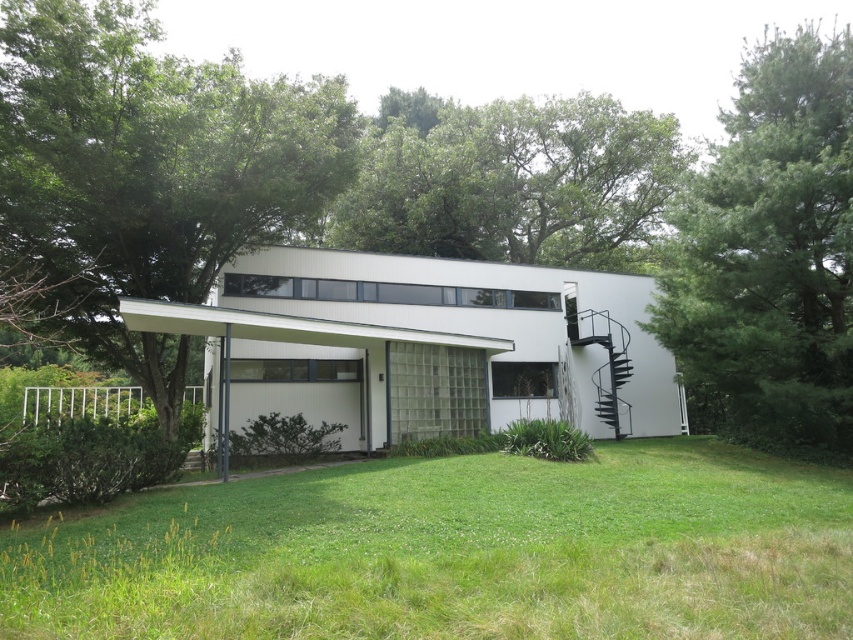
You are a landscape architect planning to add a new tree to the property. The client wants the new tree to be smaller than the existing green leafy tree at right but larger than the green leafy tree at center. Is this possible? Please explain using the trees mentioned.

The green leafy tree at right is larger than the green leafy tree at center. Therefore, it is possible to plant a new tree that is smaller than the green leafy tree at right but larger than the green leafy tree at center, as there is a size difference between them.

You are a landscape architect designing a garden path between the green leafy tree at upper left and the green leafy tree at center. Considering their sizes, which tree should the path be closer to for better visibility?

The path should be closer to the green leafy tree at upper left because it is smaller in size compared to the green leafy tree at center, ensuring better visibility.

You are standing in front of the modern house and want to determine the relative positions of two points marked on the image. Which point is closer to you, point [709,241] or point [583,118]?

Point [709,241] is closer to the viewer than point [583,118].